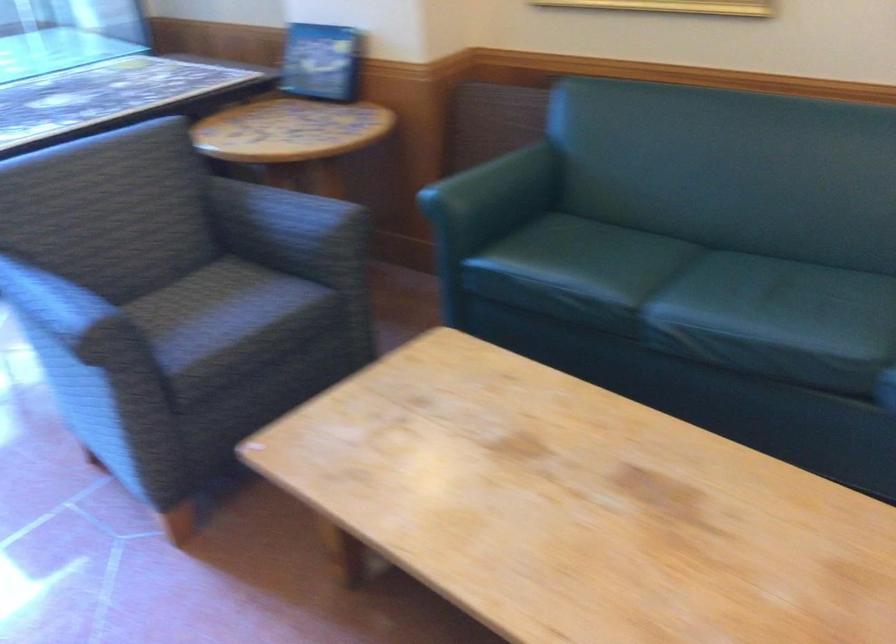
Image resolution: width=896 pixels, height=644 pixels. Describe the element at coordinates (679, 283) in the screenshot. I see `the sofa sitting surface` at that location.